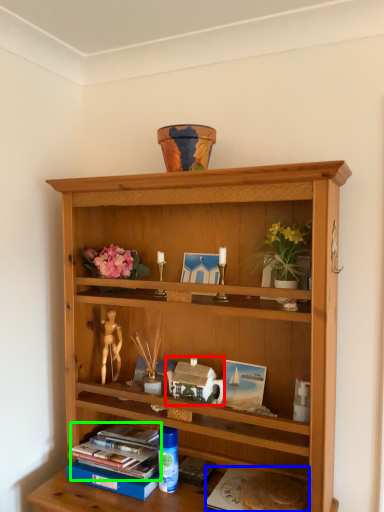
Question: Which object is the farthest from stuff (highlighted by a red box)? Choose among these: paperback book (highlighted by a blue box) or book (highlighted by a green box).

Choices:
 (A) paperback book
 (B) book

Answer: (A)